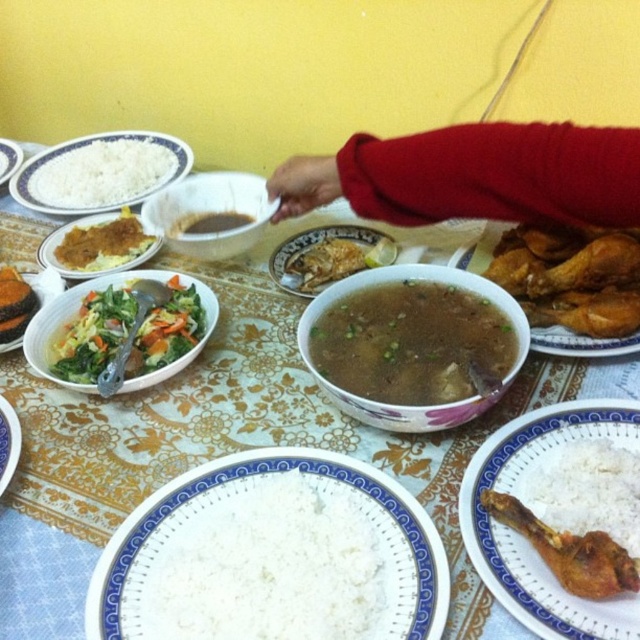
You are a guest at this meal and want to reach for the golden crispy chicken leg at lower right and the brown glossy fish at center. Considering their positions, which one is closer to you?

The golden crispy chicken leg at lower right is closer to you than the brown glossy fish at center because it is positioned lower on the table.

You are a person with a reach of 28 inches standing at the table. You want to grab the golden crispy fried chicken at right. Can you reach it?

The golden crispy fried chicken at right is 28.14 inches away from the viewer. Since your reach is 28 inches, you cannot quite reach it.

You are sitting at the table and want to grab the golden crispy chicken leg at lower right. Which direction should you reach to avoid knocking over the brown glossy fish at center?

The golden crispy chicken leg at lower right is below the brown glossy fish at center, so you should reach downward to avoid knocking over the brown glossy fish at center.